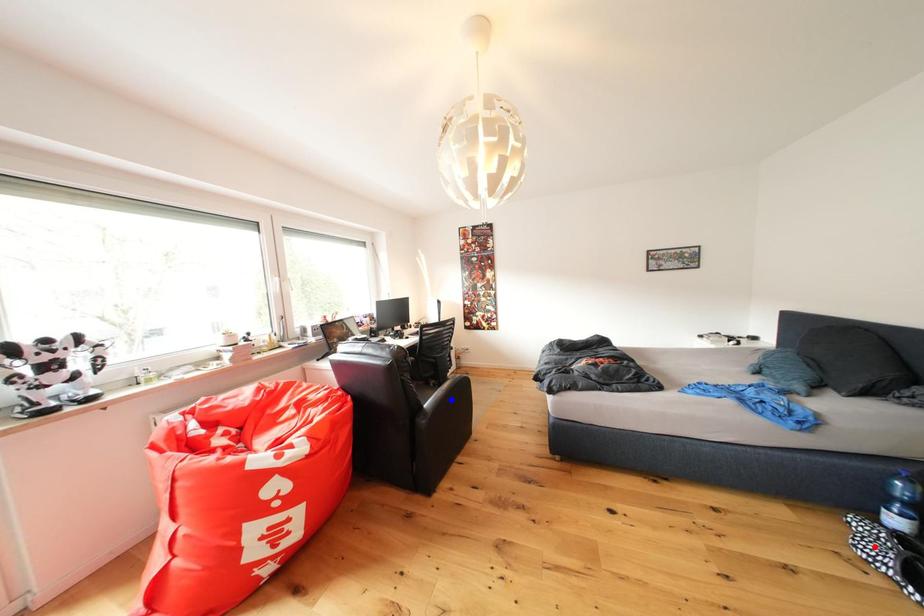
Question: Two points are marked on the image. Which point is closer to the camera?

Choices:
 (A) Blue point is closer.
 (B) Red point is closer.

Answer: (B)